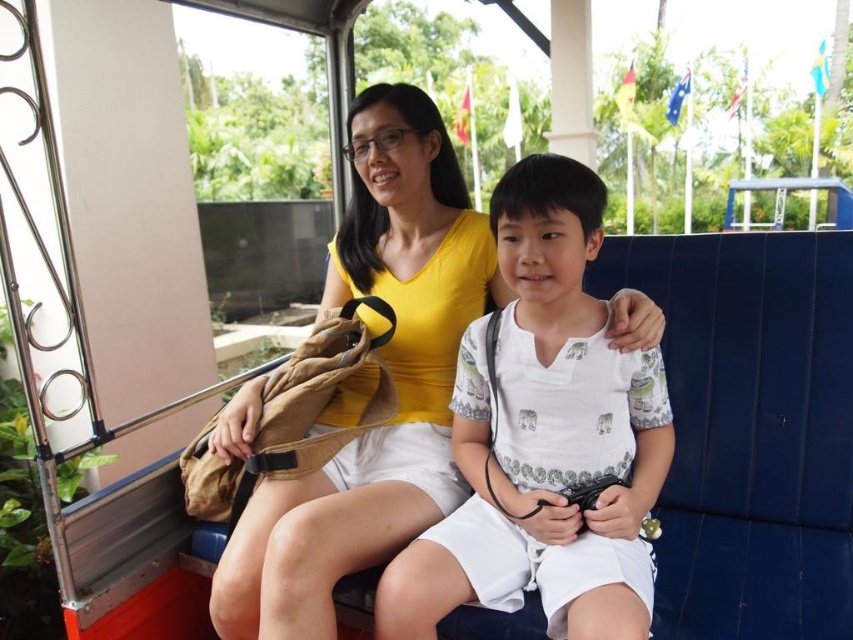
You are a passenger in a tram and want to take a photo of the scenery outside. You have a camera with a wide angle lens that requires you to hold it at least 1 meter away from your face. The camera is at the same position as the white cotton shirt at center. Can you determine if the camera is positioned far enough from your face to take the photo?

The camera is positioned at the same location as the white cotton shirt at center, which is at point (544, 438). Since the camera needs to be at least 1 meter away from your face, but the exact distance isn not provided in the description, we cannot confirm if it meets the requirement. Please ensure the camera is held at least 1 meter away.

You are a passenger in a tram and want to take a photo of the scenery outside. You have a camera with a focal length of 50mm. The camera is held at eye level, which is at point (x=544, y=438). Based on the scene description, where should you aim your camera to capture the white cotton shirt at center in the frame?

The point (x=544, y=438) marks the location of the white cotton shirt at center. To capture it, aim your camera directly at this coordinate.

You are a passenger in the tram and want to know which shirt is closer to the floor. The tram has the white cotton shirt at center and the yellow matte shirt at center. According to the scene, which one is positioned lower?

The white cotton shirt at center is below the yellow matte shirt at center, so the white cotton shirt at center is closer to the floor.